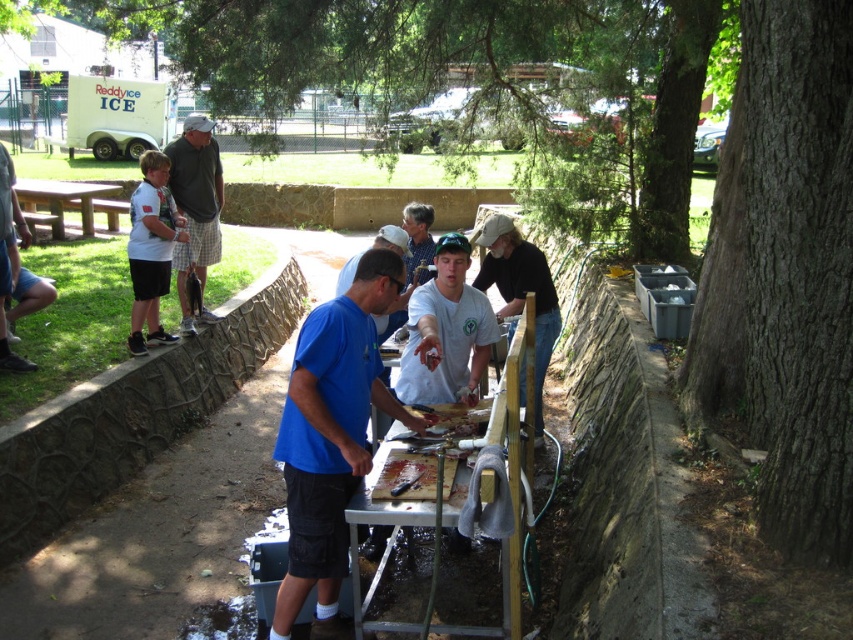
Can you confirm if green rough bark tree at right is positioned to the left of brown rough bark tree at right?

Correct, you'll find green rough bark tree at right to the left of brown rough bark tree at right.

Who is shorter, green rough bark tree at right or brown rough bark tree at right?

Standing shorter between the two is brown rough bark tree at right.

Is point (497, 24) positioned after point (764, 195)?

That is True.

Identify the location of green rough bark tree at right. (474, 81).

Between point (770, 340) and point (407, 209), which one is positioned behind?

The point (407, 209) is more distant.

Which of these two, brown rough bark tree at right or blue shirt at center, stands shorter?

Standing shorter between the two is blue shirt at center.

Does point (741, 83) come farther from viewer compared to point (408, 209)?

No, it is in front of (408, 209).

The width and height of the screenshot is (853, 640). What are the coordinates of `brown rough bark tree at right` in the screenshot? It's located at (785, 275).

Between green rough bark tree at right and white matte shirt at center, which one is positioned lower?

white matte shirt at center

Does green rough bark tree at right have a larger size compared to white matte shirt at center?

Indeed, green rough bark tree at right has a larger size compared to white matte shirt at center.

In order to click on green rough bark tree at right in this screenshot , I will do `click(474, 81)`.